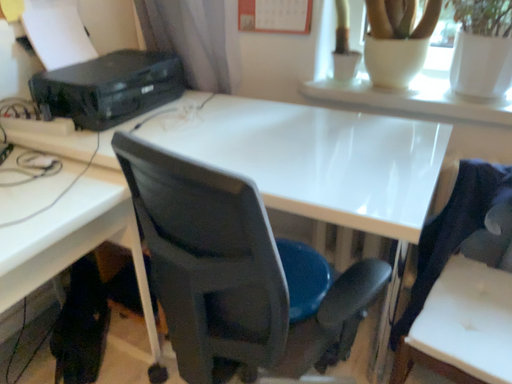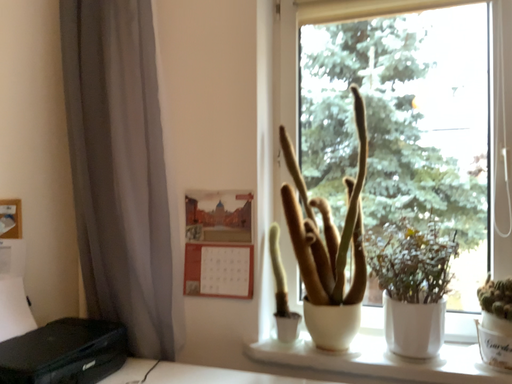
Question: How did the camera likely rotate when shooting the video?

Choices:
 (A) rotated right
 (B) rotated left

Answer: (A)